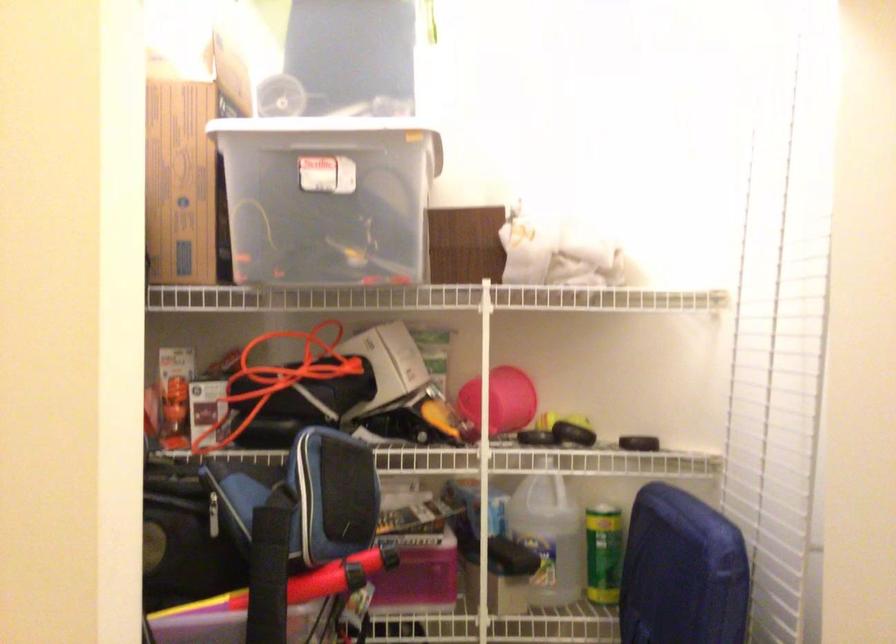
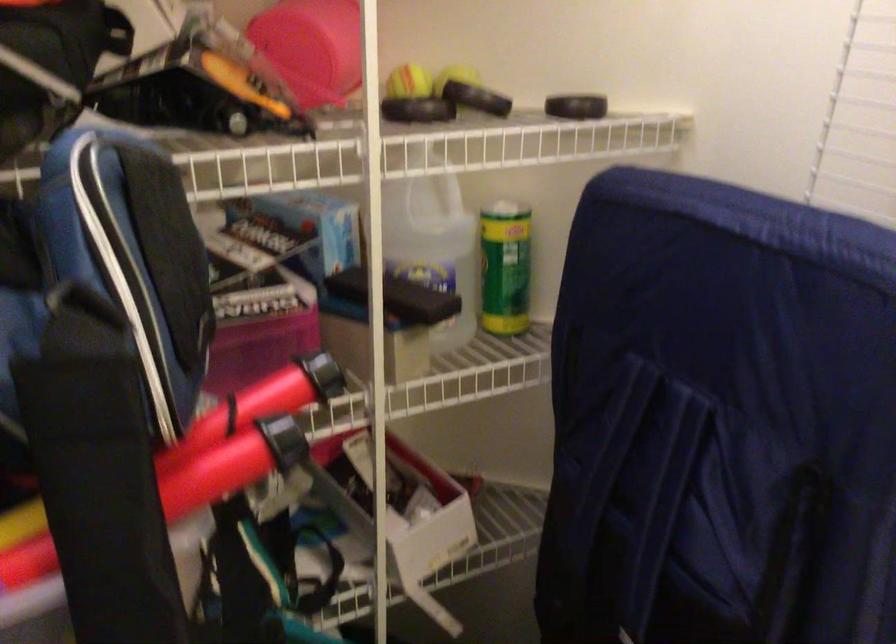
The point at (631, 444) is marked in the first image. Where is the corresponding point in the second image?

(576, 106)